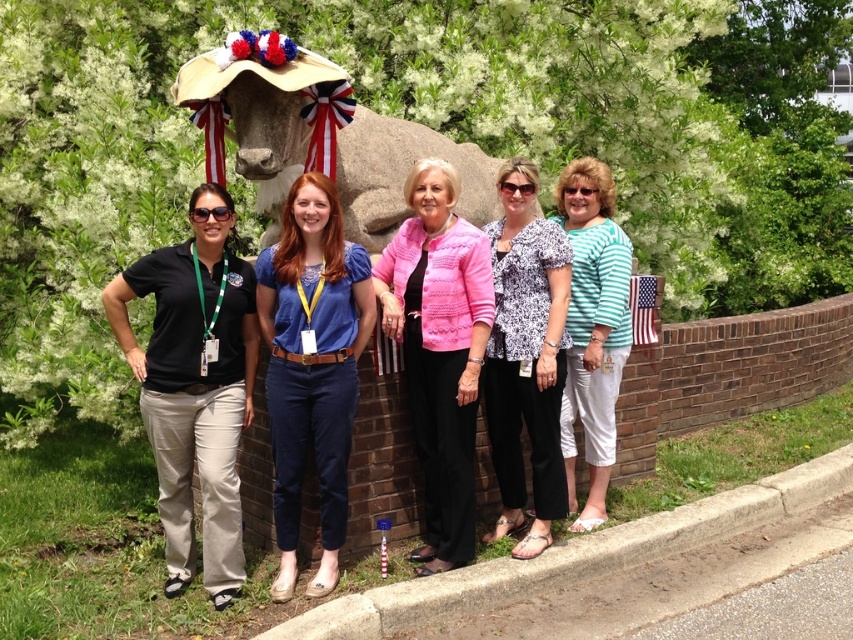
Question: Can you confirm if white printed blouse at center is positioned below concrete at lower right?

Choices:
 (A) no
 (B) yes

Answer: (A)

Question: Can you confirm if pink textured sweater at center is bigger than concrete at lower right?

Choices:
 (A) yes
 (B) no

Answer: (B)

Question: Which point appears farthest from the camera in this image?

Choices:
 (A) 447,582
 (B) 384,362
 (C) 346,97
 (D) 347,106

Answer: (B)

Question: Which point is farther to the camera?

Choices:
 (A) (380, 342)
 (B) (560, 422)

Answer: (B)

Question: Which is nearer to the black cotton shirt at left?

Choices:
 (A) red-white-blue fabric ribbon at center
 (B) concrete at lower right

Answer: (A)

Question: Does blue denim pants at center appear under concrete at lower right?

Choices:
 (A) yes
 (B) no

Answer: (B)